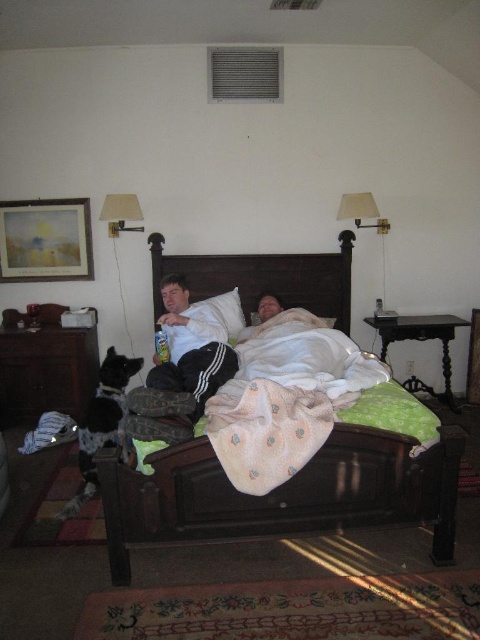
Question: Is dark wood dresser at left to the right of white soft pillow at center from the viewer's perspective?

Choices:
 (A) yes
 (B) no

Answer: (B)

Question: Estimate the real-world distances between objects in this image. Which object is closer to the white matte shirt at center?

Choices:
 (A) dark wood headboard at center
 (B) white fabric lampshade at upper right
 (C) dark wood dresser at left

Answer: (A)

Question: Which of the following is the closest to the observer?

Choices:
 (A) (134, 198)
 (B) (94, 337)
 (C) (229, 308)

Answer: (A)

Question: Observing the image, what is the correct spatial positioning of dark wood dresser at left in reference to white matte shirt at center?

Choices:
 (A) left
 (B) right

Answer: (A)

Question: Based on their relative distances, which object is nearer to the white soft pillow at center?

Choices:
 (A) white fabric lampshade at upper right
 (B) wooden bed at center
 (C) dark wood headboard at center

Answer: (C)

Question: Is white matte shirt at center wider than white fabric lampshade at upper right?

Choices:
 (A) yes
 (B) no

Answer: (A)